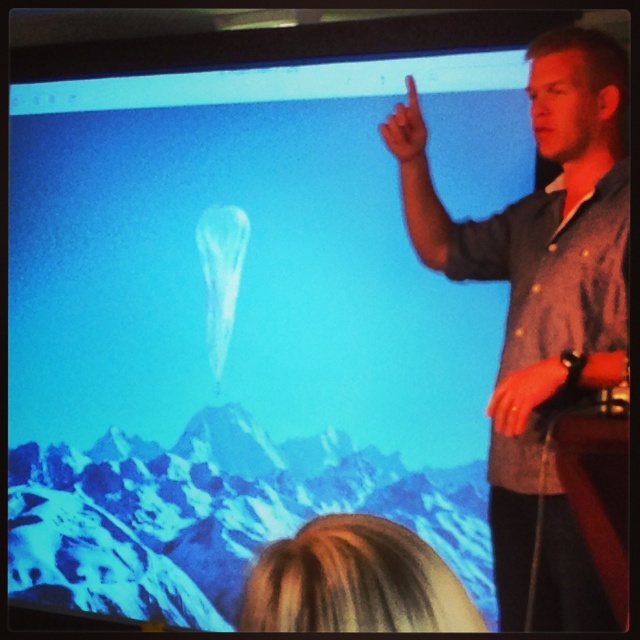
Question: Which point is closer to the camera?

Choices:
 (A) matte skin finger at upper center
 (B) gray button-down shirt at upper right
 (C) blonde hair at upper center

Answer: (C)

Question: Considering the relative positions of blonde hair at upper center and matte skin finger at upper center in the image provided, where is blonde hair at upper center located with respect to matte skin finger at upper center?

Choices:
 (A) below
 (B) above

Answer: (A)

Question: Observing the image, what is the correct spatial positioning of gray button-down shirt at upper right in reference to matte skin finger at upper center?

Choices:
 (A) left
 (B) right

Answer: (B)

Question: Is blonde hair at upper center to the right of matte skin finger at upper center from the viewer's perspective?

Choices:
 (A) yes
 (B) no

Answer: (B)

Question: Which of the following is the closest to the observer?

Choices:
 (A) (522, 200)
 (B) (412, 93)

Answer: (B)

Question: Based on their relative distances, which object is farther from the matte skin finger at upper center?

Choices:
 (A) blonde hair at upper center
 (B) gray button-down shirt at upper right

Answer: (A)